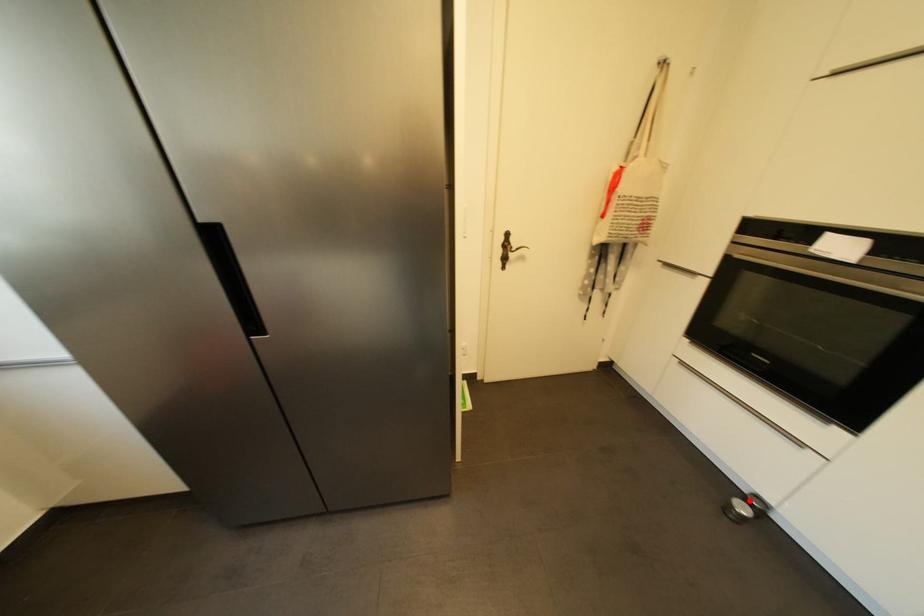
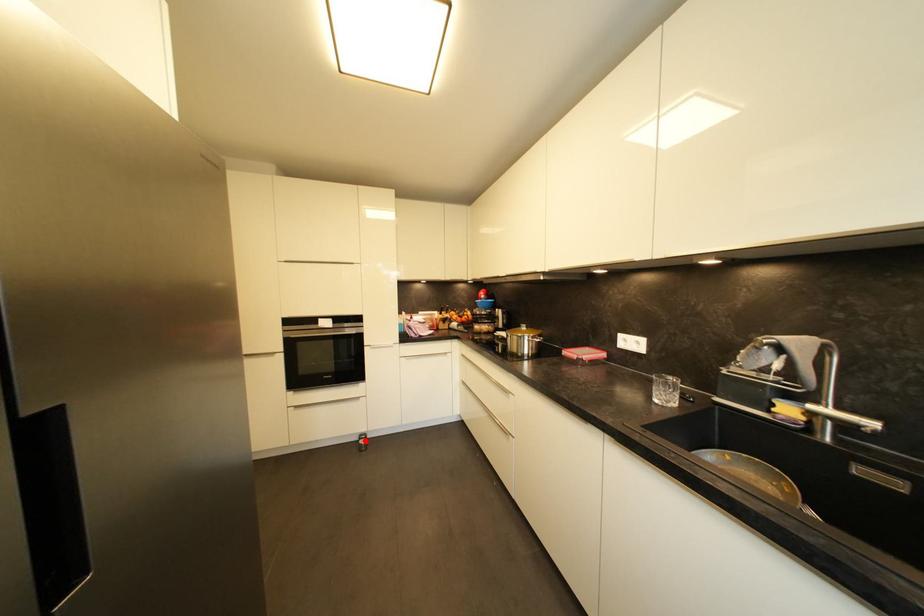
I am providing you with two images of the same scene from different viewpoints. A red point is marked on the first image and another point is marked on the second image. Do the highlighted points in image1 and image2 indicate the same real-world spot?

Yes